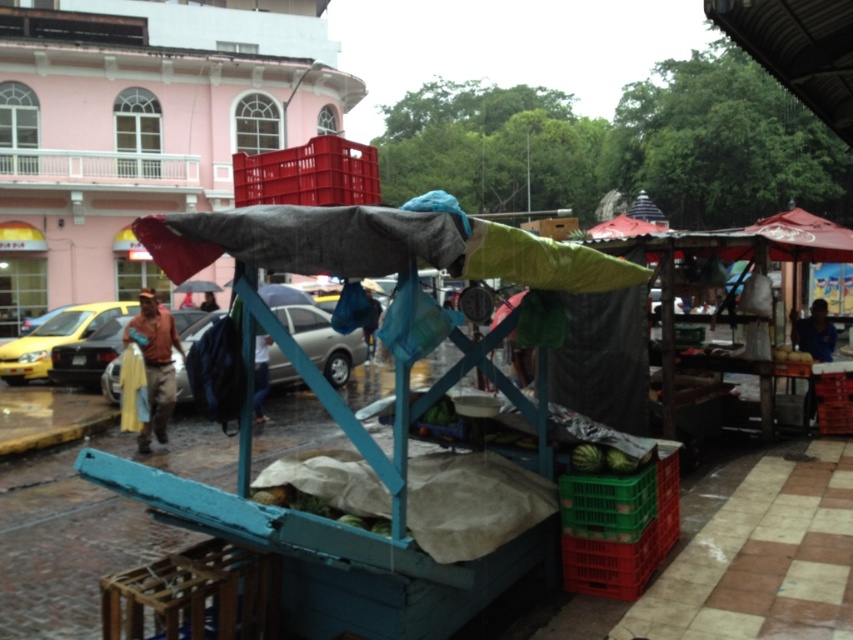
You are a customer at the market and want to reach the matte plastic crate at upper center to pick up some fruit. There is a yellow matte taxi at left blocking your path. Which direction should you move around the taxi to reach the crate?

You should move around the yellow matte taxi at left to the right side since the matte plastic crate at upper center is positioned on the right side of the yellow matte taxi at left.

You are standing at the entrance of the market stall and want to pick up two items located at the coordinates point (299, 154) and point (65, 333). Which item should you reach for first to minimize the distance walked?

You should reach for the item at point (299, 154) first because it is closer to you than the item at point (65, 333).

You are a delivery person who needs to deliver a package to the metallic silver car at center and the brown leather jacket at left. Which item requires a larger box for packing?

The metallic silver car at center requires a larger box for packing because it is larger in size than the brown leather jacket at left.